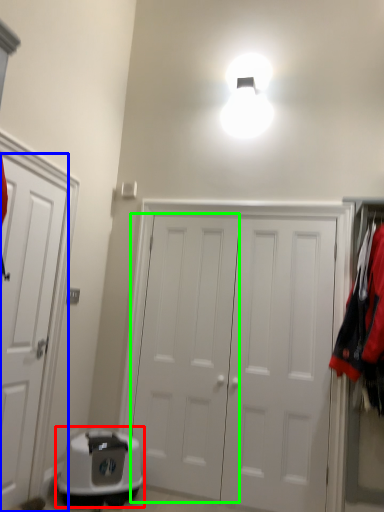
Question: Estimate the real-world distances between objects in this image. Which object is farther from appliance (highlighted by a red box), door (highlighted by a blue box) or door (highlighted by a green box)?

Choices:
 (A) door
 (B) door

Answer: (A)